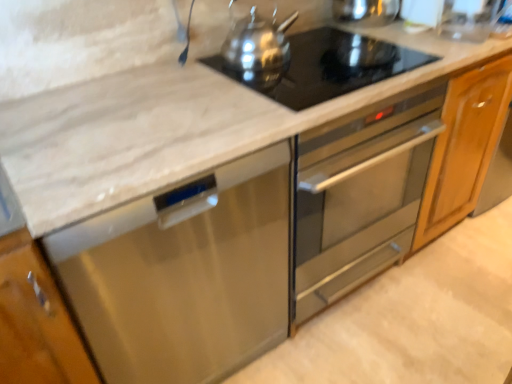
Question: Should I look upward or downward to see white marble cabinet at lower left?

Choices:
 (A) up
 (B) down

Answer: (B)

Question: Is black glass cooktop at upper center not close to polished stainless steel kettle at upper center?

Choices:
 (A) no
 (B) yes

Answer: (A)

Question: Is black glass cooktop at upper center to the right of polished stainless steel kettle at upper center from the viewer's perspective?

Choices:
 (A) yes
 (B) no

Answer: (A)

Question: Considering the relative sizes of black glass cooktop at upper center and polished stainless steel kettle at upper center in the image provided, is black glass cooktop at upper center wider than polished stainless steel kettle at upper center?

Choices:
 (A) no
 (B) yes

Answer: (B)

Question: Can you confirm if black glass cooktop at upper center is bigger than polished stainless steel kettle at upper center?

Choices:
 (A) yes
 (B) no

Answer: (B)

Question: Considering the relative sizes of black glass cooktop at upper center and polished stainless steel kettle at upper center in the image provided, is black glass cooktop at upper center smaller than polished stainless steel kettle at upper center?

Choices:
 (A) yes
 (B) no

Answer: (A)

Question: Does black glass cooktop at upper center have a lesser width compared to polished stainless steel kettle at upper center?

Choices:
 (A) yes
 (B) no

Answer: (B)

Question: Is white marble cabinet at lower left positioned before polished stainless steel kettle at upper center?

Choices:
 (A) no
 (B) yes

Answer: (B)

Question: From the image's perspective, is white marble cabinet at lower left located beneath polished stainless steel kettle at upper center?

Choices:
 (A) no
 (B) yes

Answer: (B)

Question: Is white marble cabinet at lower left thinner than polished stainless steel kettle at upper center?

Choices:
 (A) yes
 (B) no

Answer: (B)

Question: From a real-world perspective, is white marble cabinet at lower left positioned under polished stainless steel kettle at upper center based on gravity?

Choices:
 (A) yes
 (B) no

Answer: (A)

Question: Can you confirm if white marble cabinet at lower left is bigger than polished stainless steel kettle at upper center?

Choices:
 (A) yes
 (B) no

Answer: (A)

Question: Could you tell me if white marble cabinet at lower left is turned towards polished stainless steel kettle at upper center?

Choices:
 (A) yes
 (B) no

Answer: (B)

Question: Considering the relative positions of black glass cooktop at upper center and stainless steel dishwasher at lower left in the image provided, is black glass cooktop at upper center to the right of stainless steel dishwasher at lower left from the viewer's perspective?

Choices:
 (A) yes
 (B) no

Answer: (A)